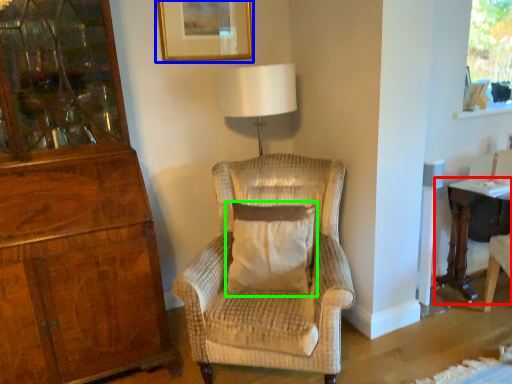
Question: Which is nearer to the desk (highlighted by a red box)? picture frame (highlighted by a blue box) or pillow (highlighted by a green box).

Choices:
 (A) picture frame
 (B) pillow

Answer: (B)